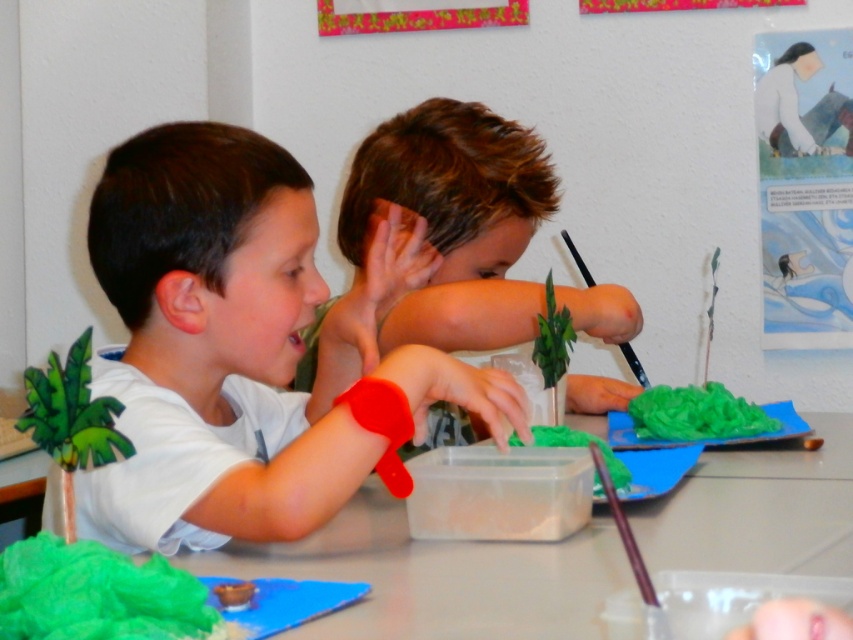
Question: Is green paper at center in front of brown hair boy at center?

Choices:
 (A) yes
 (B) no

Answer: (A)

Question: Among these points, which one is nearest to the camera?

Choices:
 (A) (199, 480)
 (B) (479, 604)

Answer: (B)

Question: Which point is closer to the camera taking this photo?

Choices:
 (A) (426, 589)
 (B) (422, 184)

Answer: (A)

Question: Is white matte shirt at center further to camera compared to green paper at center?

Choices:
 (A) no
 (B) yes

Answer: (B)

Question: Which object is farther from the camera taking this photo?

Choices:
 (A) brown hair boy at center
 (B) white matte shirt at center
 (C) green paper at center

Answer: (A)

Question: Where is white matte shirt at center located in relation to brown hair boy at center in the image?

Choices:
 (A) below
 (B) above

Answer: (A)